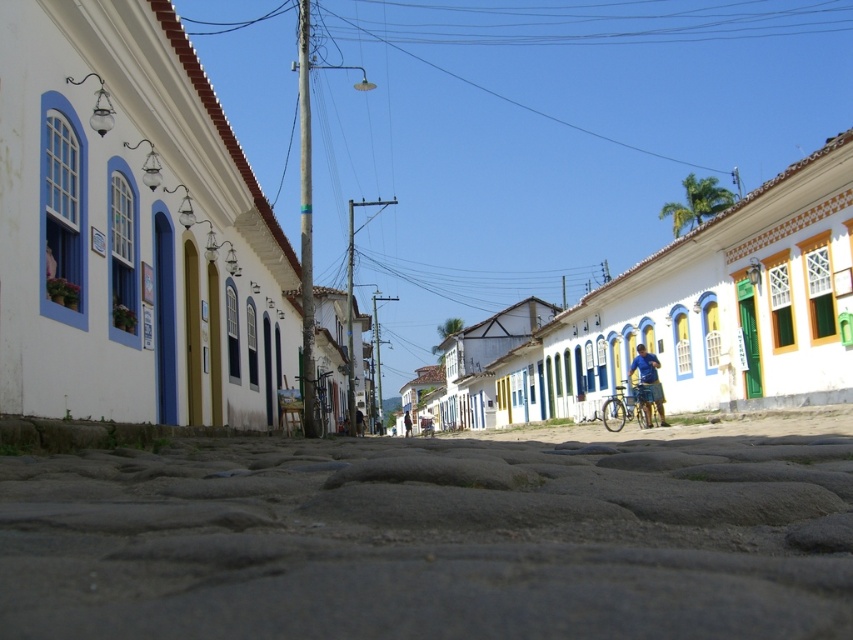
Based on the photo, can you confirm if white matte building at center is thinner than gray cobblestone alley at center?

In fact, white matte building at center might be wider than gray cobblestone alley at center.

Is white matte building at center bigger than gray cobblestone alley at center?

Yes, white matte building at center is bigger than gray cobblestone alley at center.

This screenshot has height=640, width=853. Describe the element at coordinates (128, 228) in the screenshot. I see `white matte building at center` at that location.

Identify the location of white matte building at center. The image size is (853, 640). (128, 228).

Based on the photo, can you confirm if gray cobblestone alley at center is positioned to the right of silver metallic bicycle at center?

No, gray cobblestone alley at center is not to the right of silver metallic bicycle at center.

Find the location of a particular element. The height and width of the screenshot is (640, 853). gray cobblestone alley at center is located at coordinates (431, 540).

I want to click on gray cobblestone alley at center, so click(431, 540).

Which is more to the left, white matte building at center or silver metallic bicycle at center?

silver metallic bicycle at center is more to the left.

Which is behind, point (746, 205) or point (614, 400)?

The point (614, 400) is more distant.

Locate an element on the screen. white matte building at center is located at coordinates (128, 228).